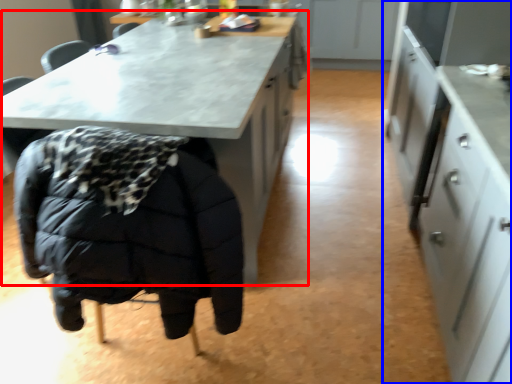
Question: Which object appears farthest to the camera in this image, table (highlighted by a red box) or cabinetry (highlighted by a blue box)?

Choices:
 (A) table
 (B) cabinetry

Answer: (A)